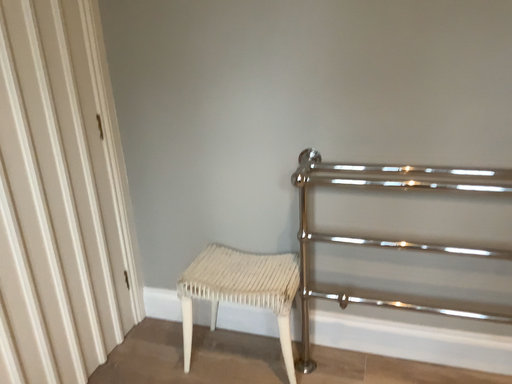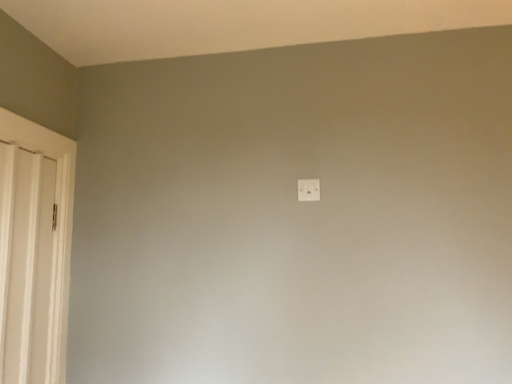
Question: How did the camera likely rotate when shooting the video?

Choices:
 (A) rotated downward
 (B) rotated upward

Answer: (B)